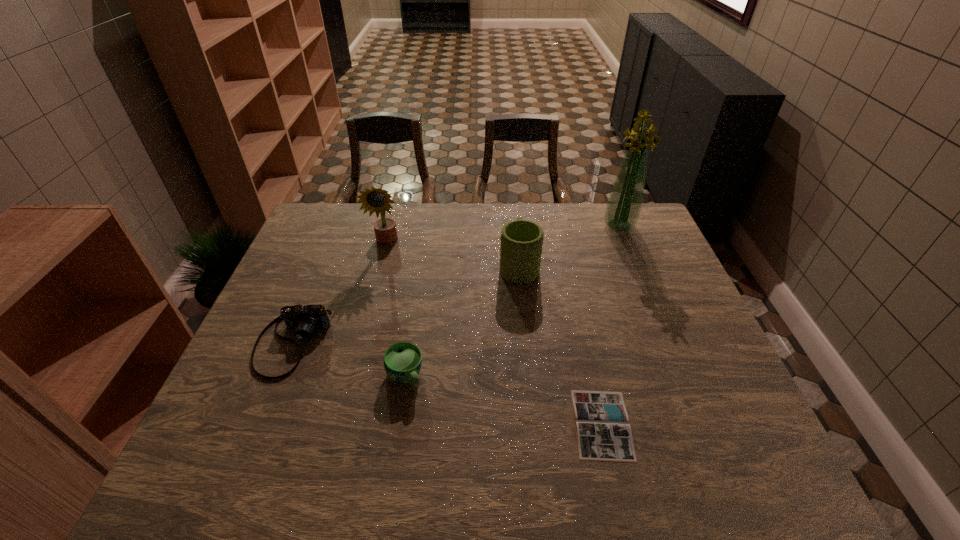
This screenshot has height=540, width=960. In order to click on object positioned at the near edge in this screenshot , I will do (603, 432).

The width and height of the screenshot is (960, 540). Find the location of `object situated at the left edge`. object situated at the left edge is located at coordinates (304, 319).

What are the coordinates of `object located in the right edge section of the desktop` in the screenshot? It's located at (623, 208).

Find the location of a particular element. The image size is (960, 540). object present at the far right corner is located at coordinates (623, 208).

In the image, there is a desktop. Where is `vacant space at the far edge`? The width and height of the screenshot is (960, 540). vacant space at the far edge is located at coordinates (418, 228).

The image size is (960, 540). In the image, there is a desktop. In order to click on free space at the near edge in this screenshot , I will do `click(453, 459)`.

In the image, there is a desktop. Where is `vacant space at the left edge`? This screenshot has width=960, height=540. vacant space at the left edge is located at coordinates (264, 404).

At what (x,y) coordinates should I click in order to perform the action: click on vacant point at the right edge. Please return your answer as a coordinate pair (x, y). The width and height of the screenshot is (960, 540). Looking at the image, I should click on (672, 394).

The height and width of the screenshot is (540, 960). Find the location of `vacant point at the far left corner`. vacant point at the far left corner is located at coordinates (348, 206).

This screenshot has height=540, width=960. In order to click on free point between the second tallest object and the mug in this screenshot , I will do `click(453, 254)`.